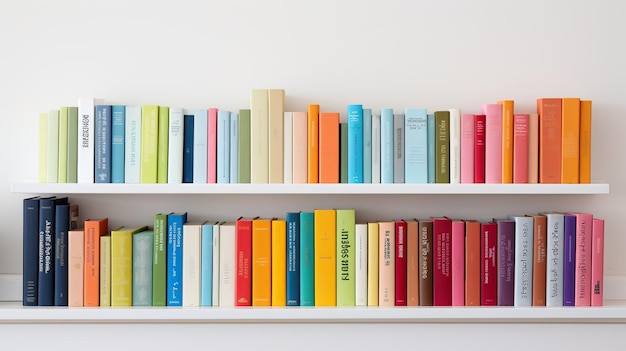
Find the location of a particular element. The image size is (626, 351). red books is located at coordinates (244, 264), (478, 148), (399, 239), (441, 236), (486, 239).